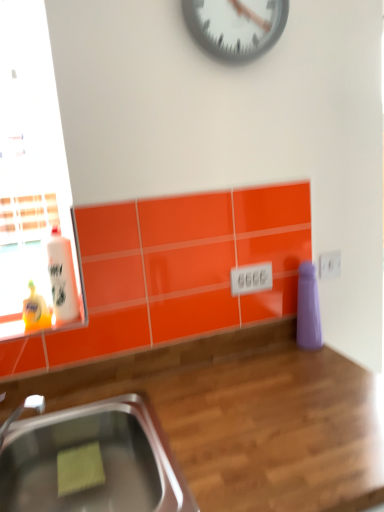
Question: Should I look upward or downward to see stainless steel sink at lower left?

Choices:
 (A) up
 (B) down

Answer: (B)

Question: Is white glossy bottle at left further to camera compared to metallic gray clock at upper center?

Choices:
 (A) yes
 (B) no

Answer: (A)

Question: From the image's perspective, is white glossy bottle at left on top of metallic gray clock at upper center?

Choices:
 (A) yes
 (B) no

Answer: (B)

Question: Is white glossy bottle at left facing away from metallic gray clock at upper center?

Choices:
 (A) no
 (B) yes

Answer: (A)

Question: Does white glossy bottle at left have a greater width compared to metallic gray clock at upper center?

Choices:
 (A) no
 (B) yes

Answer: (B)

Question: From a real-world perspective, is white glossy bottle at left over metallic gray clock at upper center?

Choices:
 (A) yes
 (B) no

Answer: (B)

Question: Is white glossy bottle at left located outside metallic gray clock at upper center?

Choices:
 (A) yes
 (B) no

Answer: (A)

Question: Does metallic gray clock at upper center have a larger size compared to wooden at lower right?

Choices:
 (A) no
 (B) yes

Answer: (A)

Question: Is metallic gray clock at upper center in contact with wooden at lower right?

Choices:
 (A) no
 (B) yes

Answer: (A)

Question: Would you say wooden at lower right is part of metallic gray clock at upper center's contents?

Choices:
 (A) yes
 (B) no

Answer: (B)

Question: From a real-world perspective, is metallic gray clock at upper center located higher than wooden at lower right?

Choices:
 (A) no
 (B) yes

Answer: (B)

Question: Can you confirm if metallic gray clock at upper center is shorter than wooden at lower right?

Choices:
 (A) no
 (B) yes

Answer: (B)

Question: Can you confirm if metallic gray clock at upper center is thinner than wooden at lower right?

Choices:
 (A) yes
 (B) no

Answer: (A)

Question: Are stainless steel sink at lower left and metallic gray clock at upper center far apart?

Choices:
 (A) no
 (B) yes

Answer: (B)